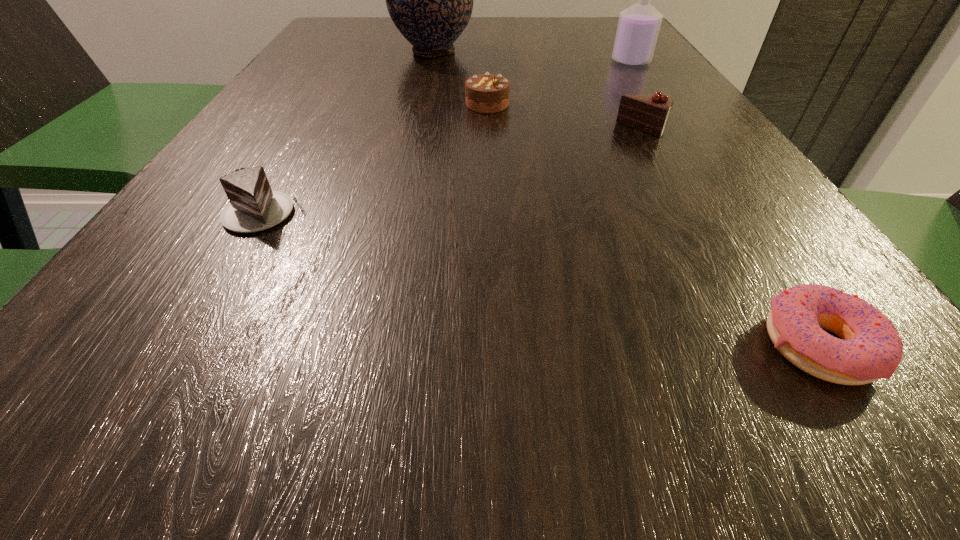
At what (x,y) coordinates should I click in order to perform the action: click on vacant region located 0.170m on the back of the pottery. Please return your answer as a coordinate pair (x, y). Image resolution: width=960 pixels, height=540 pixels. Looking at the image, I should click on (441, 18).

Identify the location of vacant position located on the front of the perfume. The image size is (960, 540). pos(645,84).

Image resolution: width=960 pixels, height=540 pixels. I want to click on vacant space located 0.360m on the front of the second chocolate cake from right to left, so click(491, 242).

Identify the location of free space located on the left of the third nearest object. (474, 130).

The image size is (960, 540). What are the coordinates of `vacant area situated 0.370m on the right of the leftmost object` in the screenshot? It's located at (579, 213).

This screenshot has width=960, height=540. What are the coordinates of `vacant area situated on the left of the doughnut` in the screenshot? It's located at (403, 345).

What are the coordinates of `object that is at the far edge` in the screenshot? It's located at (430, 0).

Identify the location of object at the near edge. (870, 348).

Locate an element on the screen. object that is at the left edge is located at coordinates (253, 206).

I want to click on perfume that is at the right edge, so point(638,27).